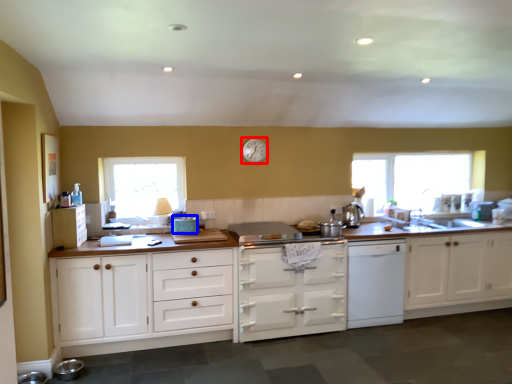
Question: Which object appears farthest to the camera in this image, clock (highlighted by a red box) or appliance (highlighted by a blue box)?

Choices:
 (A) clock
 (B) appliance

Answer: (A)